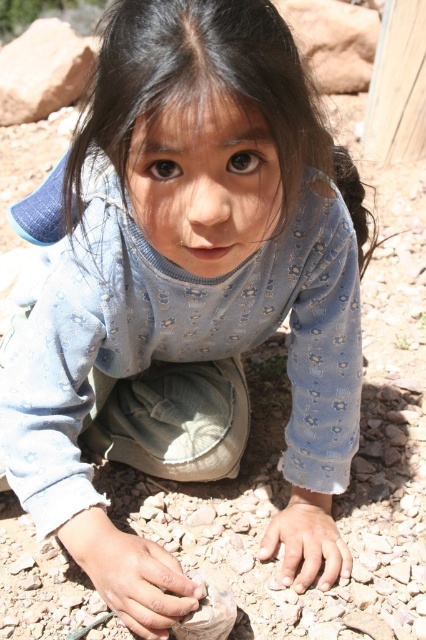
Is dirty sand at lower center below smooth stone hand at lower center?

Incorrect, dirty sand at lower center is not positioned below smooth stone hand at lower center.

The width and height of the screenshot is (426, 640). In order to click on dirty sand at lower center in this screenshot , I will do `click(131, 573)`.

This screenshot has height=640, width=426. Find the location of `dirty sand at lower center`. dirty sand at lower center is located at coordinates (131, 573).

Locate an element on the screen. The height and width of the screenshot is (640, 426). dirty sand at lower center is located at coordinates (131, 573).

Does black silky hair at center have a smaller size compared to smooth stone hand at lower center?

No.

Who is positioned more to the right, black silky hair at center or smooth stone hand at lower center?

smooth stone hand at lower center is more to the right.

Measure the distance between black silky hair at center and camera.

black silky hair at center is 24.02 inches away from camera.

The image size is (426, 640). In order to click on black silky hair at center in this screenshot , I will do `click(207, 93)`.

Looking at this image, can you confirm if black silky hair at center is positioned above dirty sand at lower center?

Yes.

Does black silky hair at center have a smaller size compared to dirty sand at lower center?

Actually, black silky hair at center might be larger than dirty sand at lower center.

Does point (279, 20) come in front of point (94, 545)?

Yes, point (279, 20) is in front of point (94, 545).

Identify the location of black silky hair at center. (207, 93).